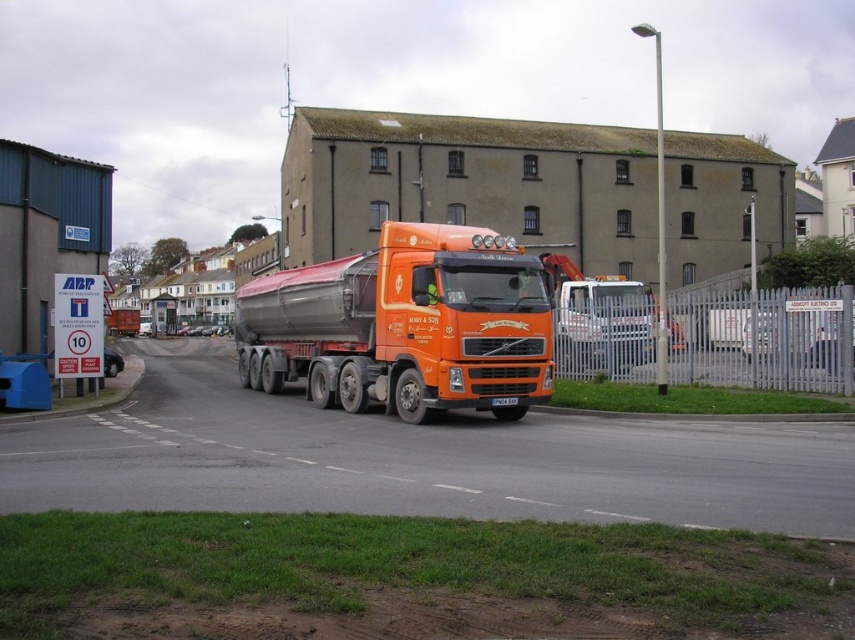
You are a delivery driver who needs to park your orange metallic truck at center in a loading zone. However, there is an orange matte tanker truck at center already occupying the space. Can you park your truck in the same spot without overlapping?

Answer: The orange matte tanker truck at center is positioned over orange metallic truck at center, meaning they are already occupying the same space. Therefore, you cannot park your orange metallic truck at center in the same spot without overlapping.

You are a delivery driver who needs to park the orange matte tanker truck at center and the orange metallic truck at center side by side in a parking lot. The parking lot has a width of 3 meters. Can both trucks fit side by side without overlapping?

The orange matte tanker truck at center is narrower than the orange metallic truck at center. However, without knowing their exact widths, it is impossible to determine if their combined width is less than or equal to 3 meters. More information is needed to answer this question.

You are a pedestrian standing on the sidewalk and see the orange matte tanker truck at center approaching. The road has a speed limit of 10 mph as indicated by the nearby ABP sign. If the truck is currently 49.17 feet away from you, how many seconds until it reaches you?

The orange matte tanker truck at center is 49.17 feet away from the viewer. Assuming the truck is moving at the speed limit of 10 mph, it would take approximately 4.9 seconds to reach you. This is calculated by converting 10 mph to feet per second and dividing the distance by the speed.